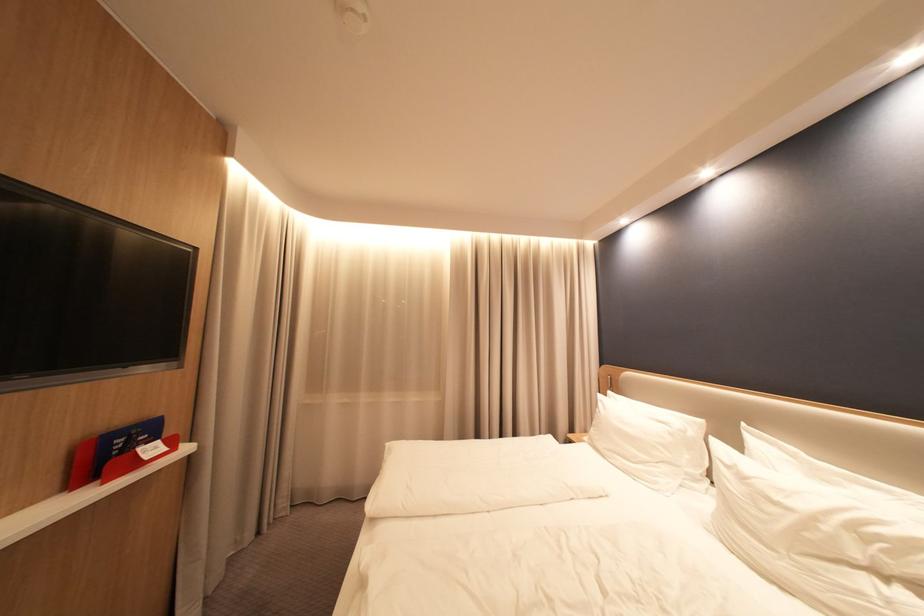
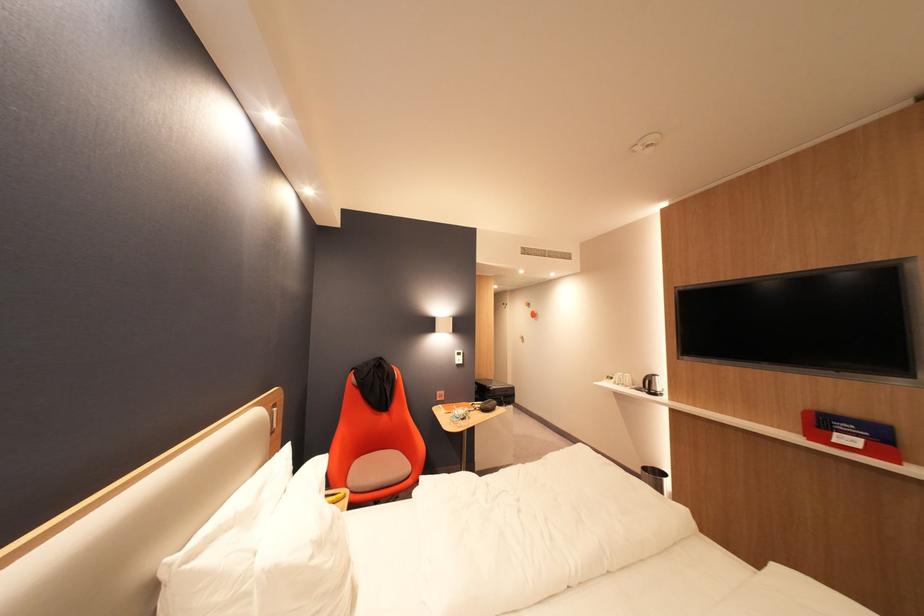
The point at (150,452) is marked in the first image. Where is the corresponding point in the second image?

(846, 435)